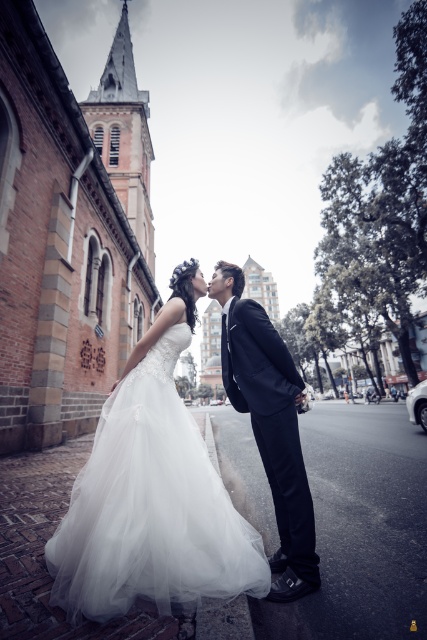
You are a photographer adjusting the focus on your camera. You have two points to focus on in the image. The first is point (146, 596) and the second is point (289, 380). Which point should you focus on to capture the couple leaning towards each other more clearly?

Point (146, 596) is closer to the viewer than point (289, 380), so focusing on point (146, 596) will capture the couple leaning towards each other more clearly.

You are a photographer trying to adjust the lighting for the couple in the image. Since the white tulle dress at center and the shiny black suit at center are positioned close to each other, which one is located to the left side?

The white tulle dress at center is to the left of the shiny black suit at center.

You are a photographer setting up for a couple photoshoot. The couple is wearing the white tulle dress at center and the shiny black suit at center. You need to adjust the lighting to ensure both outfits are equally highlighted. Considering their sizes, which outfit might require more focused lighting adjustments?

The white tulle dress at center is larger in size than the shiny black suit at center, so it might require more focused lighting adjustments to ensure proper highlighting.